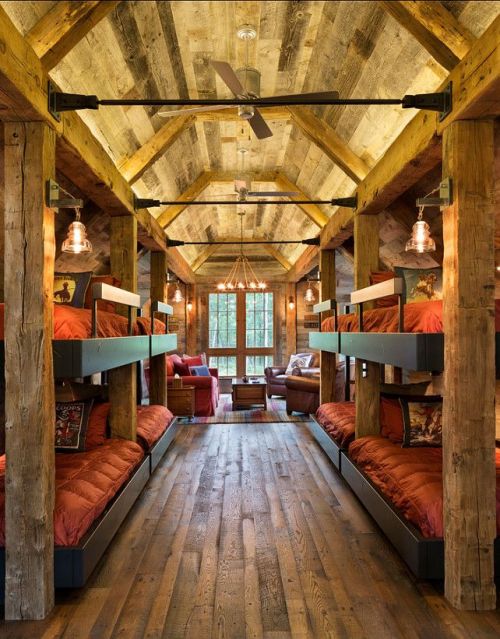
In order to click on window in this screenshot , I will do `click(225, 328)`, `click(262, 321)`, `click(254, 366)`, `click(229, 365)`.